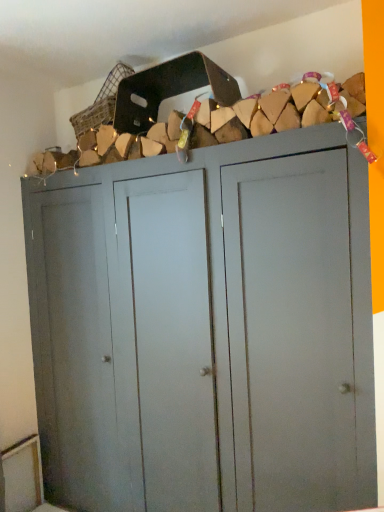
Question: From the image's perspective, is woven wicker basket at upper center located above matte gray cupboard at center?

Choices:
 (A) yes
 (B) no

Answer: (A)

Question: Considering the relative sizes of woven wicker basket at upper center and matte gray cupboard at center in the image provided, is woven wicker basket at upper center smaller than matte gray cupboard at center?

Choices:
 (A) yes
 (B) no

Answer: (A)

Question: Can you confirm if woven wicker basket at upper center is bigger than matte gray cupboard at center?

Choices:
 (A) yes
 (B) no

Answer: (B)

Question: Can you confirm if woven wicker basket at upper center is shorter than matte gray cupboard at center?

Choices:
 (A) no
 (B) yes

Answer: (B)

Question: Could you tell me if woven wicker basket at upper center is facing matte gray cupboard at center?

Choices:
 (A) no
 (B) yes

Answer: (A)

Question: Can you confirm if woven wicker basket at upper center is taller than matte gray cupboard at center?

Choices:
 (A) no
 (B) yes

Answer: (A)

Question: From a real-world perspective, is matte gray cupboard at center located beneath woven wicker basket at upper center?

Choices:
 (A) yes
 (B) no

Answer: (A)

Question: Is matte gray cupboard at center outside of woven wicker basket at upper center?

Choices:
 (A) yes
 (B) no

Answer: (A)

Question: Can you confirm if matte gray cupboard at center is positioned to the left of woven wicker basket at upper center?

Choices:
 (A) no
 (B) yes

Answer: (A)

Question: Can you confirm if matte gray cupboard at center is taller than woven wicker basket at upper center?

Choices:
 (A) no
 (B) yes

Answer: (B)

Question: Are matte gray cupboard at center and woven wicker basket at upper center located far from each other?

Choices:
 (A) no
 (B) yes

Answer: (A)

Question: Is the position of matte gray cupboard at center less distant than that of woven wicker basket at upper center?

Choices:
 (A) no
 (B) yes

Answer: (B)

Question: Is matte gray cupboard at center inside the boundaries of woven wicker basket at upper center, or outside?

Choices:
 (A) outside
 (B) inside

Answer: (A)